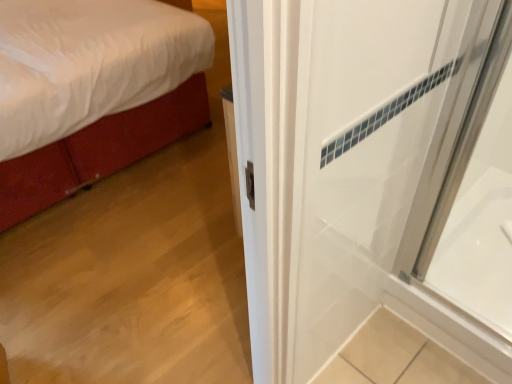
Question: Considering the relative sizes of velvet red bed at left and white glossy bathtub at right in the image provided, is velvet red bed at left thinner than white glossy bathtub at right?

Choices:
 (A) no
 (B) yes

Answer: (A)

Question: Is velvet red bed at left positioned behind white glossy bathtub at right?

Choices:
 (A) no
 (B) yes

Answer: (B)

Question: Does velvet red bed at left come in front of white glossy bathtub at right?

Choices:
 (A) yes
 (B) no

Answer: (B)

Question: From the image's perspective, is velvet red bed at left located beneath white glossy bathtub at right?

Choices:
 (A) yes
 (B) no

Answer: (B)

Question: From a real-world perspective, is velvet red bed at left on top of white glossy bathtub at right?

Choices:
 (A) no
 (B) yes

Answer: (B)

Question: Considering the relative sizes of velvet red bed at left and white glossy bathtub at right in the image provided, is velvet red bed at left bigger than white glossy bathtub at right?

Choices:
 (A) yes
 (B) no

Answer: (A)

Question: From the image's perspective, does white glossy bathtub at right appear lower than velvet red bed at left?

Choices:
 (A) no
 (B) yes

Answer: (B)

Question: Is white glossy bathtub at right positioned with its back to velvet red bed at left?

Choices:
 (A) no
 (B) yes

Answer: (A)

Question: Is velvet red bed at left completely or partially inside white glossy bathtub at right?

Choices:
 (A) no
 (B) yes

Answer: (A)

Question: Is the position of white glossy bathtub at right more distant than that of velvet red bed at left?

Choices:
 (A) yes
 (B) no

Answer: (B)

Question: Does white glossy bathtub at right have a smaller size compared to velvet red bed at left?

Choices:
 (A) no
 (B) yes

Answer: (B)

Question: Is white glossy bathtub at right facing towards velvet red bed at left?

Choices:
 (A) no
 (B) yes

Answer: (A)

Question: In the image, is white glossy bathtub at right on the left side or the right side of velvet red bed at left?

Choices:
 (A) right
 (B) left

Answer: (A)